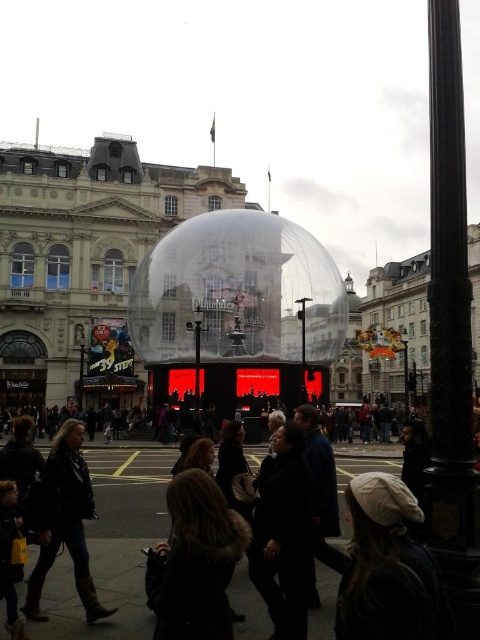
Question: Is dark brown fur coat at lower center thinner than dark woolen scarf at center?

Choices:
 (A) no
 (B) yes

Answer: (A)

Question: Is transparent plastic bubble at center to the right of black polished metal pole at right from the viewer's perspective?

Choices:
 (A) no
 (B) yes

Answer: (A)

Question: Which of these objects is positioned farthest from the dark brown leather jacket at lower left?

Choices:
 (A) dark brown fur coat at lower center
 (B) black polished metal pole at right
 (C) dark woolen scarf at center
 (D) transparent plastic bubble at center

Answer: (D)

Question: Is transparent plastic bubble at center further to the viewer compared to dark brown leather jacket at lower left?

Choices:
 (A) yes
 (B) no

Answer: (A)

Question: Which point is farther to the camera?

Choices:
 (A) transparent plastic bubble at center
 (B) dark woolen scarf at center
 (C) white fabric hat at lower right

Answer: (A)

Question: Which of the following is the farthest from the observer?

Choices:
 (A) (319, 330)
 (B) (166, 554)
 (C) (429, 84)
 (D) (39, 513)

Answer: (C)